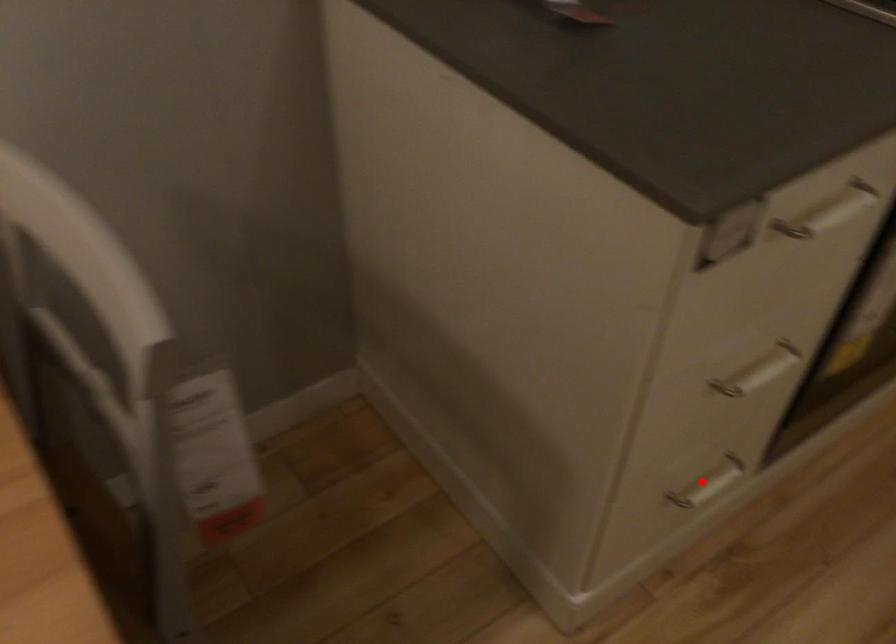
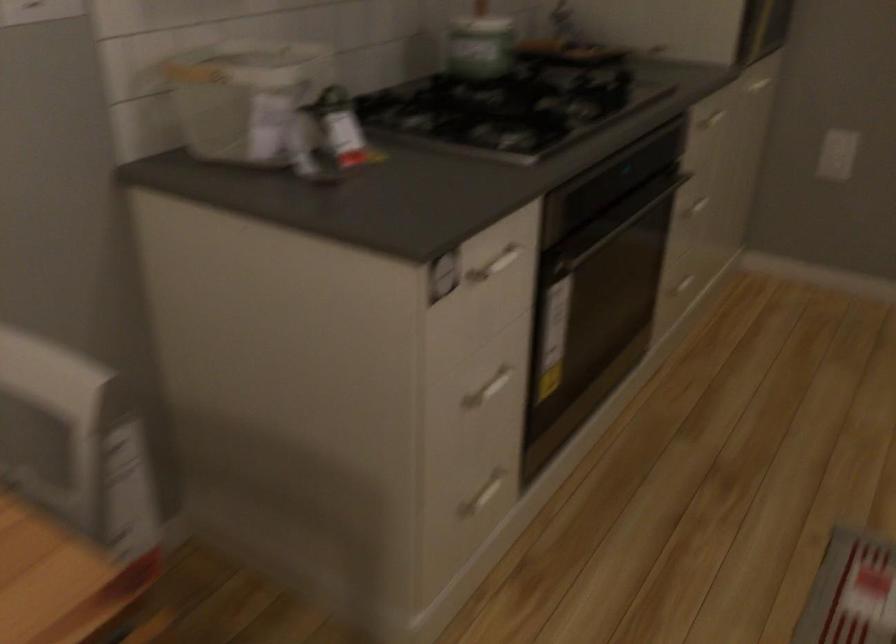
Question: I am providing you with two images of the same scene from different viewpoints. Image1 has a red point marked. In image2, the corresponding 3D location appears at what relative position? Reply with the corresponding letter.

Choices:
 (A) Closer
 (B) Farther

Answer: (B)